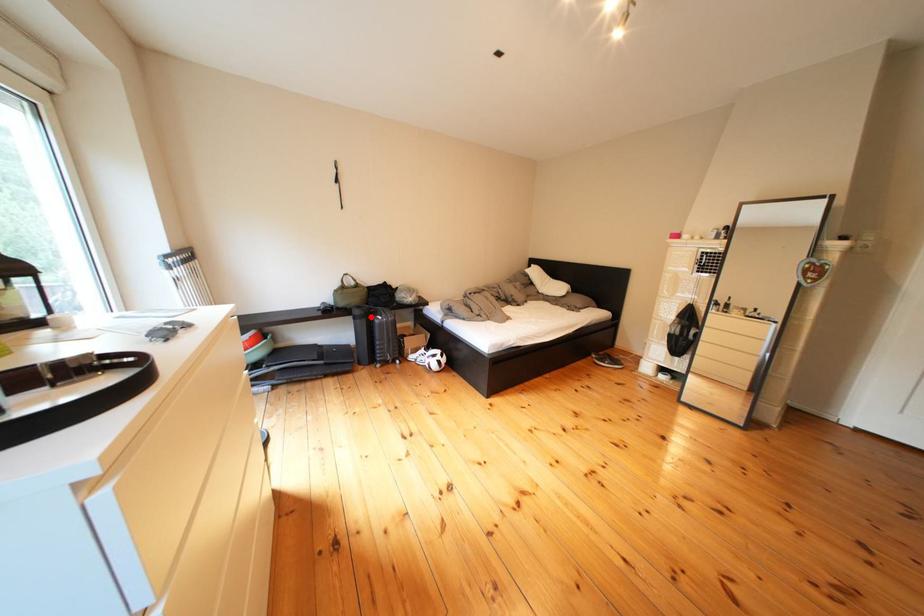
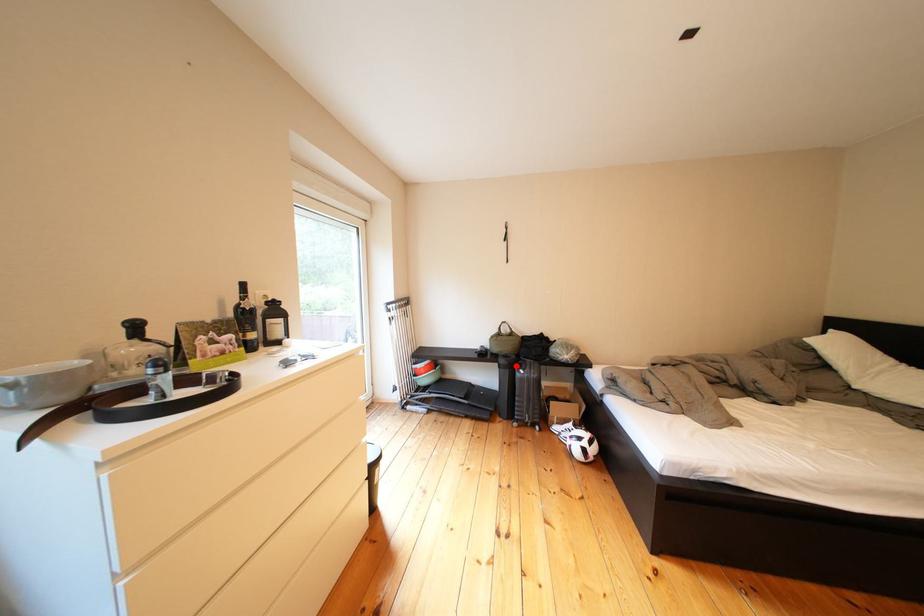
I am providing you with two images of the same scene from different viewpoints. A red point is marked on the first image and another point is marked on the second image. Do the highlighted points in image1 and image2 indicate the same real-world spot?

Yes